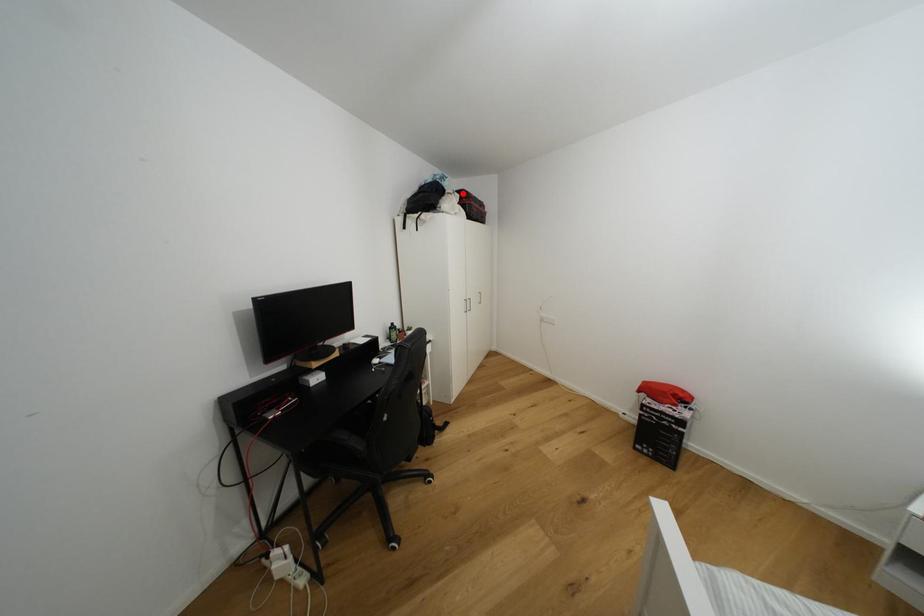
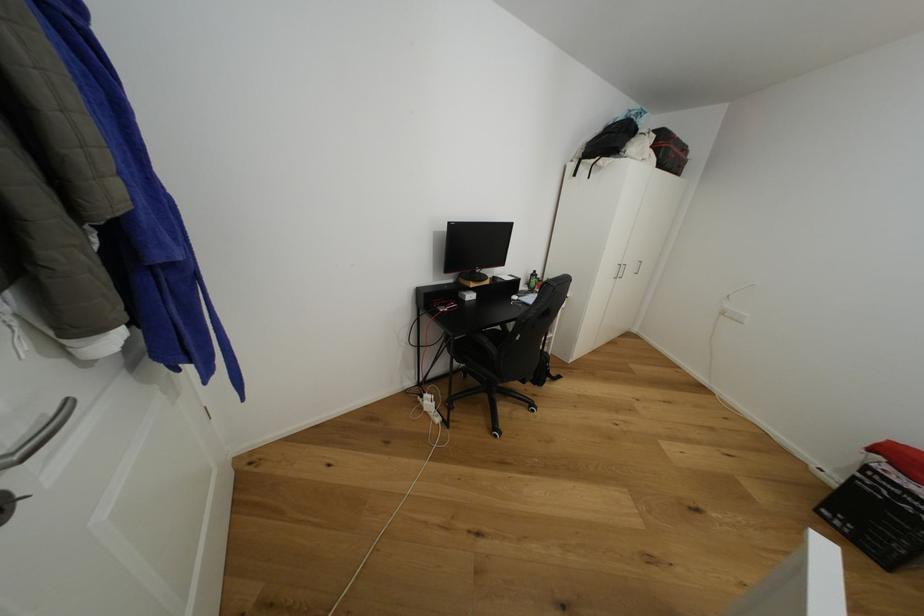
In the second image, find the point that corresponds to the highlighted location in the first image.

(660, 132)